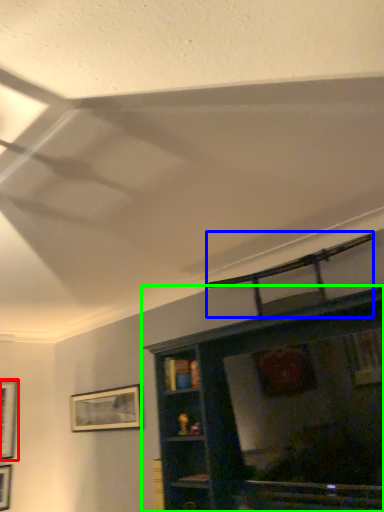
Question: Which is farther away from picture frame (highlighted by a red box)? swivel chair (highlighted by a blue box) or shelf (highlighted by a green box)?

Choices:
 (A) swivel chair
 (B) shelf

Answer: (A)